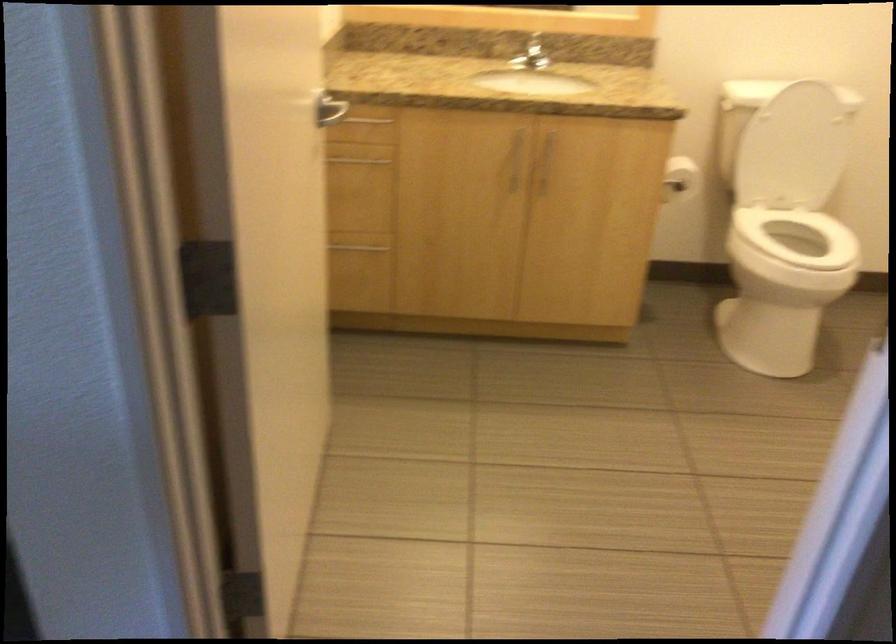
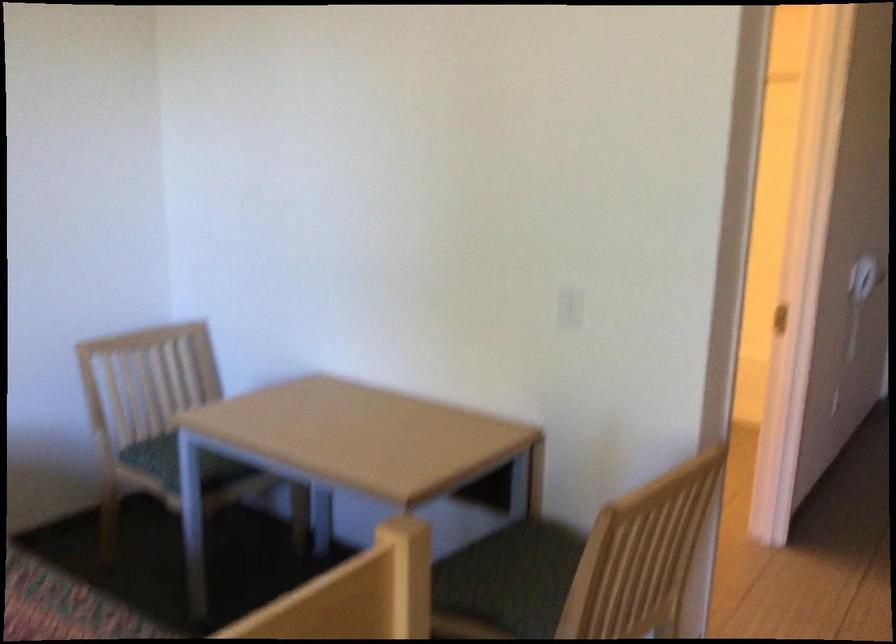
Question: I am providing you with two images of the same scene from different viewpoints. After the viewpoint changes to image2, which objects are now occluded?

Choices:
 (A) chair sitting surface
 (B) cabinet handle
 (C) white electrical outlet
 (D) black tote bag

Answer: (B)